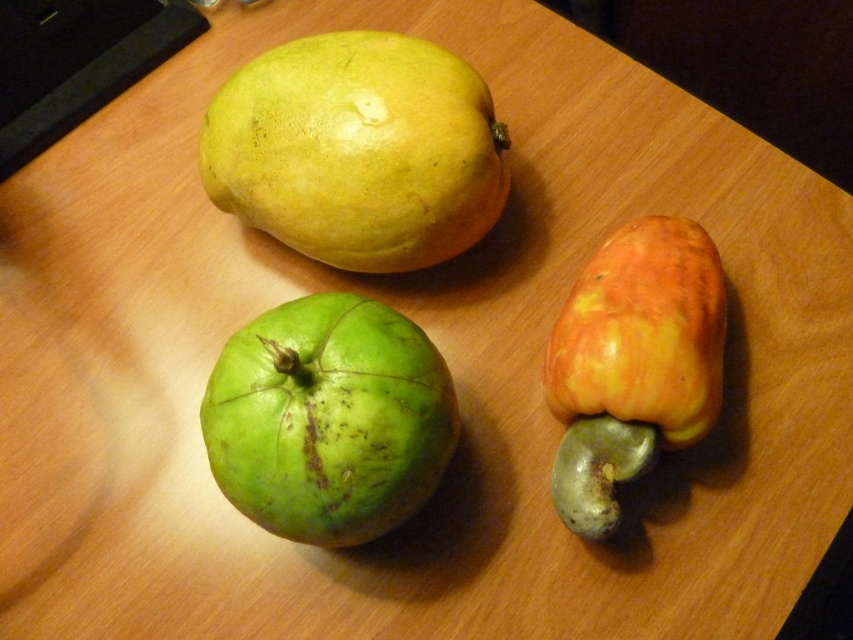
Question: Can you confirm if green matte apple at center is bigger than yellow-orange matte cashew at right?

Choices:
 (A) yes
 (B) no

Answer: (A)

Question: Which is farther from the yellow-orange matte cashew at right?

Choices:
 (A) green matte apple at center
 (B) yellow matte mango at upper left

Answer: (B)

Question: Does yellow matte mango at upper left have a smaller size compared to yellow-orange matte cashew at right?

Choices:
 (A) yes
 (B) no

Answer: (B)

Question: Which object is closer to the camera taking this photo?

Choices:
 (A) yellow-orange matte cashew at right
 (B) yellow matte mango at upper left
 (C) green matte apple at center

Answer: (C)

Question: Which point appears farthest from the camera in this image?

Choices:
 (A) (274, 449)
 (B) (409, 44)
 (C) (701, 324)

Answer: (B)

Question: Does yellow matte mango at upper left lie behind yellow-orange matte cashew at right?

Choices:
 (A) yes
 (B) no

Answer: (A)